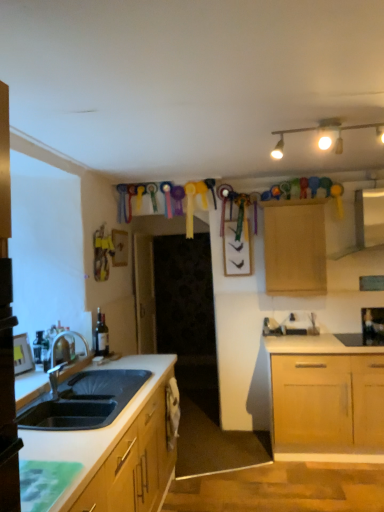
Where is `matte gold track lights at upper center`? Image resolution: width=384 pixels, height=512 pixels. matte gold track lights at upper center is located at coordinates (324, 131).

The height and width of the screenshot is (512, 384). What do you see at coordinates (101, 335) in the screenshot? I see `matte glass bottle at sink left` at bounding box center [101, 335].

Find the location of `matte white exhaust hood at upper right`. matte white exhaust hood at upper right is located at coordinates (355, 223).

From the picture: From the image's perspective, is matte white exhaust hood at upper right on matte gold track lights at upper center?

No.

Which is less distant, (346, 242) or (339, 120)?

Point (339, 120)

I want to click on exhaust hood that appears below the matte gold track lights at upper center (from a real-world perspective), so click(355, 223).

Is matte white exhaust hood at upper right completely or partially outside of matte gold track lights at upper center?

Yes.

Identify the location of appliance located on the right of matte white exhaust hood at upper right. The height and width of the screenshot is (512, 384). (373, 326).

From the image's perspective, is matte white exhaust hood at upper right located above or below black glass wine bottle at upper right?

Based on their image positions, matte white exhaust hood at upper right is located above black glass wine bottle at upper right.

How different are the orientations of matte white exhaust hood at upper right and black glass wine bottle at upper right in degrees?

matte white exhaust hood at upper right and black glass wine bottle at upper right are facing 0.681 degrees away from each other.

Measure the distance between matte gold track lights at upper center and wooden cabinet at upper center.

matte gold track lights at upper center and wooden cabinet at upper center are 36.42 inches apart from each other.

Do you think matte gold track lights at upper center is within wooden cabinet at upper center, or outside of it?

matte gold track lights at upper center cannot be found inside wooden cabinet at upper center.

Is point (280, 138) closer or farther from the camera than point (311, 239)?

Point (280, 138) is positioned closer to the camera compared to point (311, 239).

Find the location of `appliance below the matte gold track lights at upper center (from a real-world perspective)`. appliance below the matte gold track lights at upper center (from a real-world perspective) is located at coordinates (x=373, y=326).

Would you consider black glass wine bottle at upper right to be distant from matte gold track lights at upper center?

Yes, black glass wine bottle at upper right and matte gold track lights at upper center are located far from each other.

In the scene shown: Is black glass wine bottle at upper right positioned beyond the bounds of matte gold track lights at upper center?

Yes, black glass wine bottle at upper right is located beyond the bounds of matte gold track lights at upper center.

In the scene shown: From the image's perspective, which one is positioned higher, black glass wine bottle at upper right or matte gold track lights at upper center?

matte gold track lights at upper center is shown above in the image.

From the picture: Is matte glass bottle at sink left positioned with its back to matte white exhaust hood at upper right?

No, matte glass bottle at sink left is not facing away from matte white exhaust hood at upper right.

Is matte white exhaust hood at upper right a part of matte glass bottle at sink left?

Actually, matte white exhaust hood at upper right is outside matte glass bottle at sink left.

How different are the orientations of matte glass bottle at sink left and matte white exhaust hood at upper right in degrees?

matte glass bottle at sink left and matte white exhaust hood at upper right are facing 89.5 degrees away from each other.

Is there a large distance between matte glass bottle at sink left and matte white exhaust hood at upper right?

matte glass bottle at sink left is far away from matte white exhaust hood at upper right.

Does point (381, 314) appear closer or farther from the camera than point (100, 335)?

Point (381, 314) is positioned farther from the camera compared to point (100, 335).

From a real-world perspective, which object rests below the other?

black glass wine bottle at upper right is physically lower.

From the image's perspective, is black glass wine bottle at upper right beneath matte glass bottle at sink left?

Yes.

Where is `bottle above the black glass wine bottle at upper right (from a real-world perspective)`? This screenshot has height=512, width=384. bottle above the black glass wine bottle at upper right (from a real-world perspective) is located at coordinates (101, 335).

Which object is closer to the camera taking this photo, black glass wine bottle at upper right or matte white exhaust hood at upper right?

matte white exhaust hood at upper right is in front.

In the scene shown: Which is more to the left, black glass wine bottle at upper right or matte white exhaust hood at upper right?

Positioned to the left is matte white exhaust hood at upper right.

Considering the points (375, 343) and (374, 229), which point is in front, point (375, 343) or point (374, 229)?

Positioned in front is point (375, 343).

Which is correct: black glass wine bottle at upper right is inside matte white exhaust hood at upper right, or outside of it?

black glass wine bottle at upper right is spatially situated outside matte white exhaust hood at upper right.

The height and width of the screenshot is (512, 384). I want to click on lamp in front of the matte white exhaust hood at upper right, so click(x=324, y=131).

At what (x,y) coordinates should I click in order to perform the action: click on appliance on the right of matte white exhaust hood at upper right. Please return your answer as a coordinate pair (x, y). The height and width of the screenshot is (512, 384). Looking at the image, I should click on (373, 326).

Looking at the image, which one is located closer to matte glass bottle at sink left, matte gold track lights at upper center or black glass wine bottle at upper right?

matte gold track lights at upper center is positioned closer to the anchor matte glass bottle at sink left.

When comparing their distances from black glass wine bottle at upper right, does matte gold track lights at upper center or wooden cabinet at upper center seem further?

Based on the image, matte gold track lights at upper center appears to be further to black glass wine bottle at upper right.

When comparing their distances from wooden cabinet at upper center, does matte white exhaust hood at upper right or matte gold track lights at upper center seem closer?

Based on the image, matte white exhaust hood at upper right appears to be nearer to wooden cabinet at upper center.

Which object lies nearer to the anchor point wooden cabinet at upper center, black glass wine bottle at upper right or matte white exhaust hood at upper right?

Among the two, matte white exhaust hood at upper right is located nearer to wooden cabinet at upper center.

From the picture: Estimate the real-world distances between objects in this image. Which object is further from matte gold track lights at upper center, black glass wine bottle at upper right or matte glass bottle at sink left?

The object further to matte gold track lights at upper center is matte glass bottle at sink left.

Looking at the image, which one is located closer to matte gold track lights at upper center, matte white exhaust hood at upper right or wooden cabinet at upper center?

The object closer to matte gold track lights at upper center is wooden cabinet at upper center.

Looking at the image, which one is located further to matte white exhaust hood at upper right, black glass wine bottle at upper right or matte gold track lights at upper center?

Based on the image, matte gold track lights at upper center appears to be further to matte white exhaust hood at upper right.

Considering their positions, is black glass wine bottle at upper right positioned closer to matte glass bottle at sink left than wooden cabinet at upper center?

The object closer to matte glass bottle at sink left is wooden cabinet at upper center.

You are a GUI agent. You are given a task and a screenshot of the screen. Output one action in this format:
    pyautogui.click(x=<x>, y=<y>)
    Task: Click on the exhaust hood between matte gold track lights at upper center and black glass wine bottle at upper right in the front-back direction
    
    Given the screenshot: What is the action you would take?
    pyautogui.click(x=355, y=223)

Identify the location of cabinetry that lies between matte white exhaust hood at upper right and black glass wine bottle at upper right from top to bottom. (295, 247).

Image resolution: width=384 pixels, height=512 pixels. In order to click on lamp located between matte glass bottle at sink left and matte white exhaust hood at upper right in the left-right direction in this screenshot , I will do `click(324, 131)`.

Identify the location of exhaust hood between matte glass bottle at sink left and black glass wine bottle at upper right from left to right. (x=355, y=223).